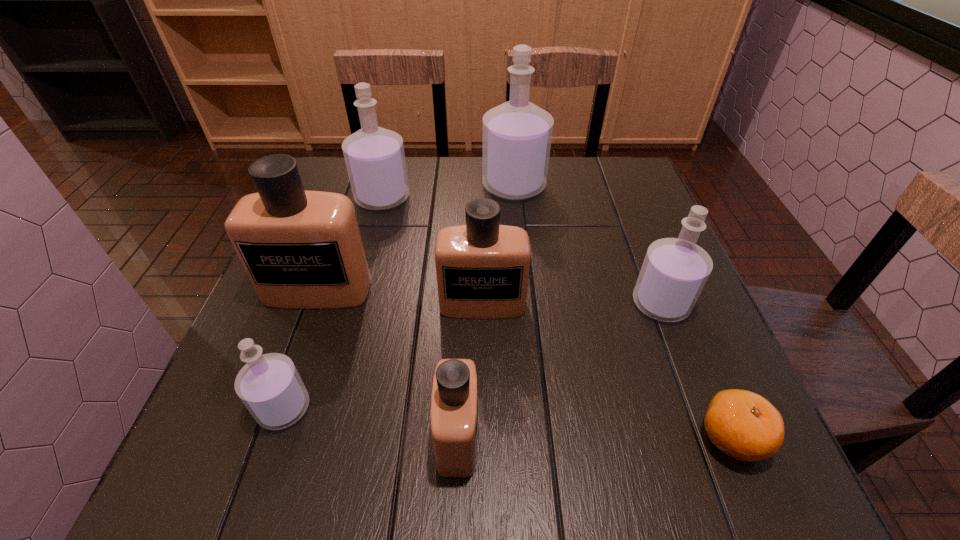
Where is `clementine that is at the near edge`? This screenshot has width=960, height=540. clementine that is at the near edge is located at coordinates (744, 425).

You are a GUI agent. You are given a task and a screenshot of the screen. Output one action in this format:
    pyautogui.click(x=<x>, y=<y>)
    Task: Click on the perfume that is at the right edge
    The image size is (960, 540).
    Given the screenshot: What is the action you would take?
    pyautogui.click(x=675, y=270)

At what (x,y) coordinates should I click in order to perform the action: click on clementine located in the right edge section of the desktop. Please return your answer as a coordinate pair (x, y). The width and height of the screenshot is (960, 540). Looking at the image, I should click on (744, 425).

Where is `object situated at the far left corner`? The width and height of the screenshot is (960, 540). object situated at the far left corner is located at coordinates (374, 156).

Identify the location of object that is positioned at the near right corner. This screenshot has height=540, width=960. (744, 425).

Find the location of a particular element. The width and height of the screenshot is (960, 540). vacant region at the far edge of the desktop is located at coordinates (482, 191).

The width and height of the screenshot is (960, 540). Identify the location of free region at the left edge of the desktop. (319, 353).

In the image, there is a desktop. At what (x,y) coordinates should I click in order to perform the action: click on free space at the right edge. Please return your answer as a coordinate pair (x, y). Looking at the image, I should click on (646, 376).

The image size is (960, 540). In the image, there is a desktop. What are the coordinates of `vacant space at the near left corner` in the screenshot? It's located at (205, 491).

Locate an element on the screen. vacant area that lies between the third smallest purple perfume and the smallest beige perfume is located at coordinates (420, 317).